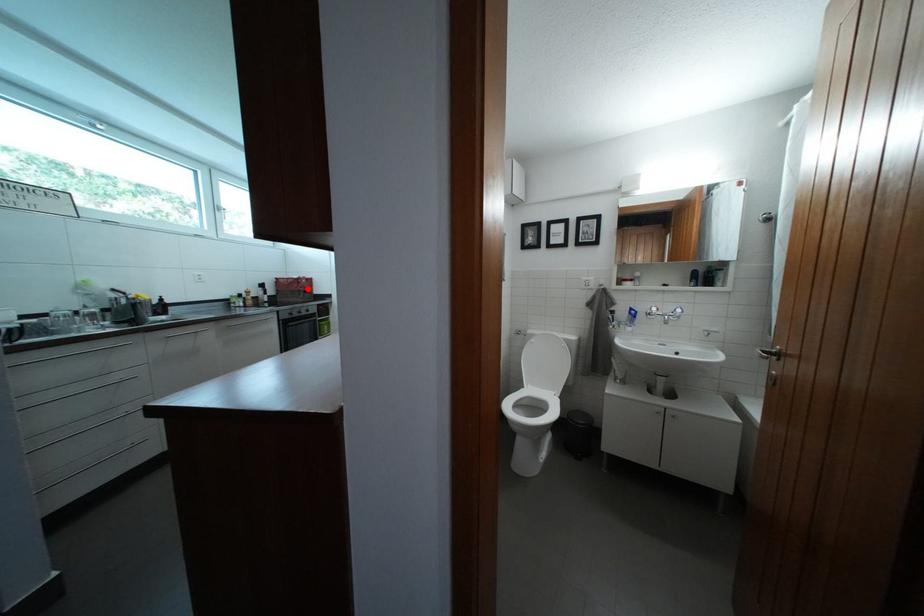
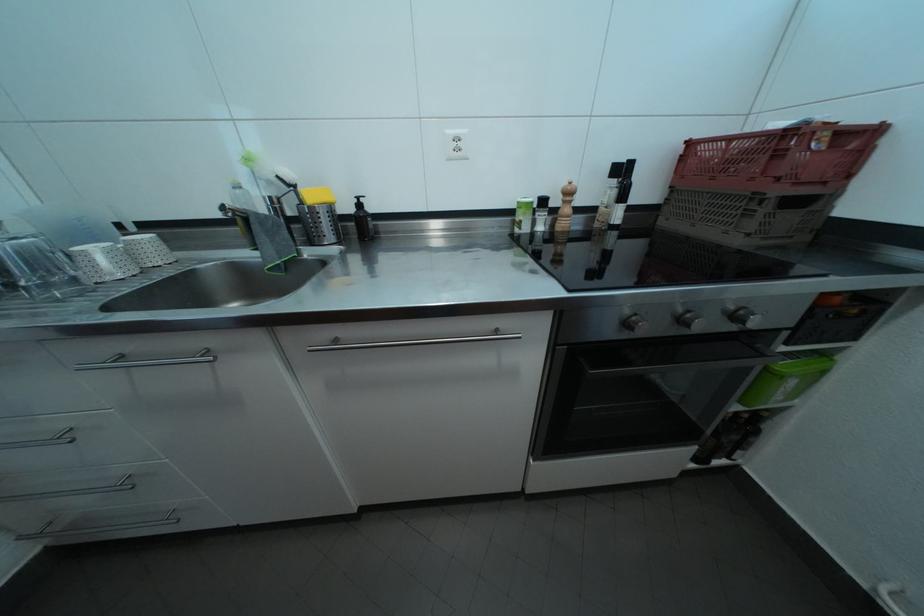
Question: I am providing you with two images of the same scene from different viewpoints. In image1, a red point is highlighted. Considering the same 3D point in image2, which of the following is correct?

Choices:
 (A) It is closer
 (B) It is farther

Answer: (B)